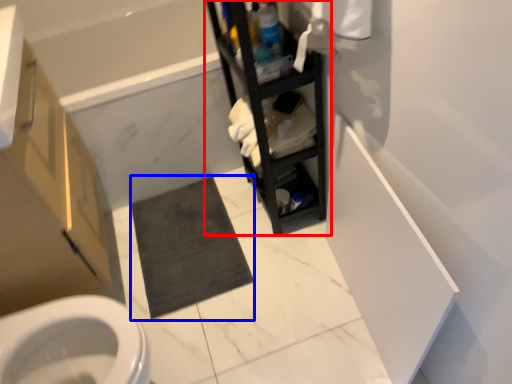
Question: Among these objects, which one is nearest to the camera, shelf (highlighted by a red box) or bath mat (highlighted by a blue box)?

Choices:
 (A) shelf
 (B) bath mat

Answer: (A)